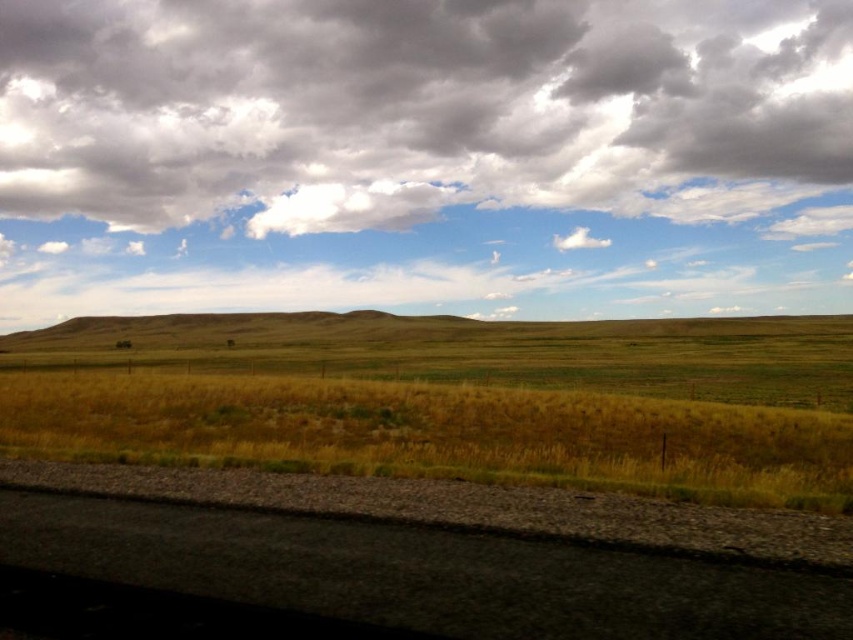
Question: Does cloudy sky at upper center have a lesser width compared to black asphalt train track at lower left?

Choices:
 (A) no
 (B) yes

Answer: (A)

Question: Among these points, which one is farthest from the camera?

Choices:
 (A) (566, 323)
 (B) (238, 577)
 (C) (115, 170)

Answer: (C)

Question: Which of the following is the farthest from the observer?

Choices:
 (A) yellow dry grass at center
 (B) cloudy sky at upper center
 (C) black asphalt train track at lower left

Answer: (B)

Question: Does cloudy sky at upper center lie behind yellow dry grass at center?

Choices:
 (A) no
 (B) yes

Answer: (B)

Question: Estimate the real-world distances between objects in this image. Which object is closer to the black asphalt train track at lower left?

Choices:
 (A) cloudy sky at upper center
 (B) yellow dry grass at center

Answer: (B)

Question: Can you confirm if cloudy sky at upper center is bigger than black asphalt train track at lower left?

Choices:
 (A) no
 (B) yes

Answer: (B)